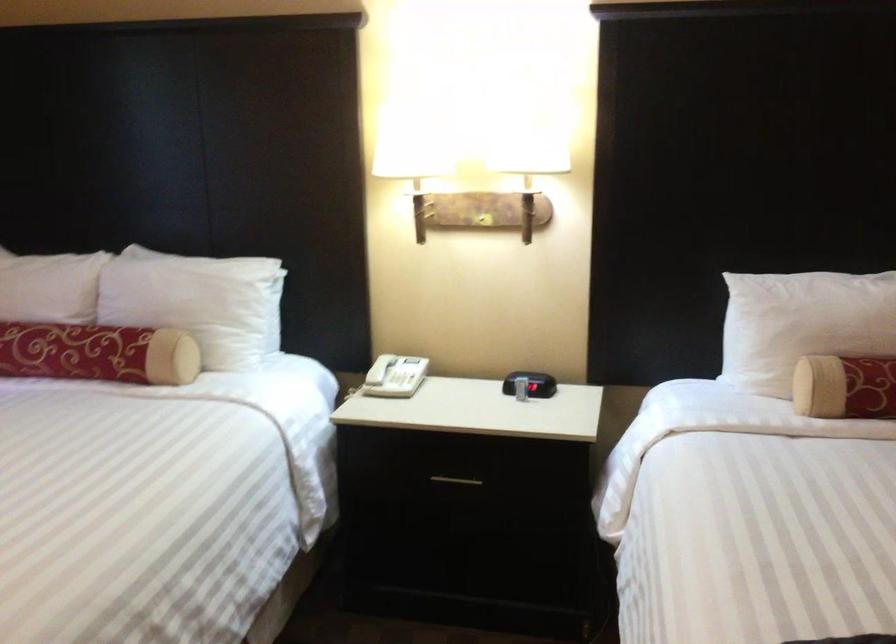
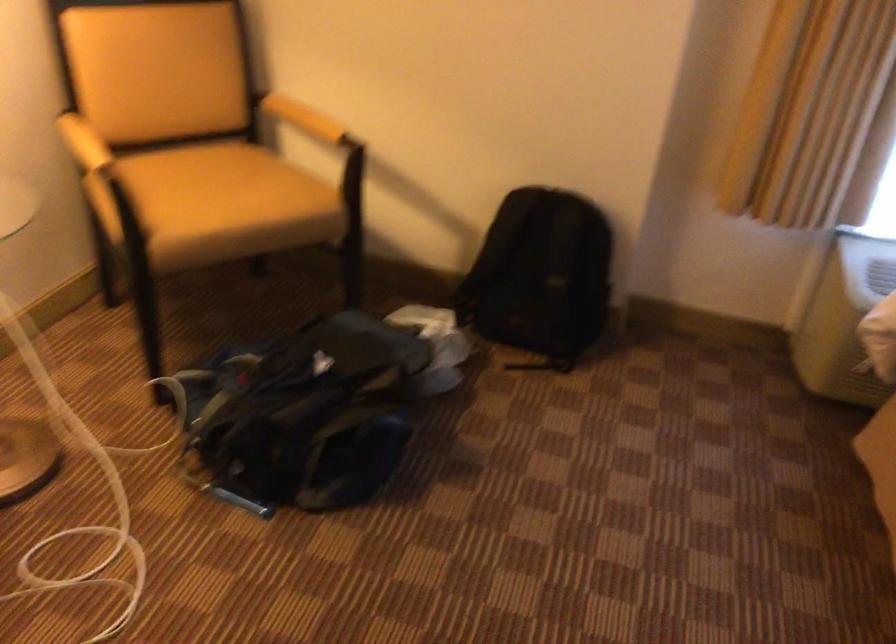
How did the camera likely rotate?

The camera's rotation is toward left-down.